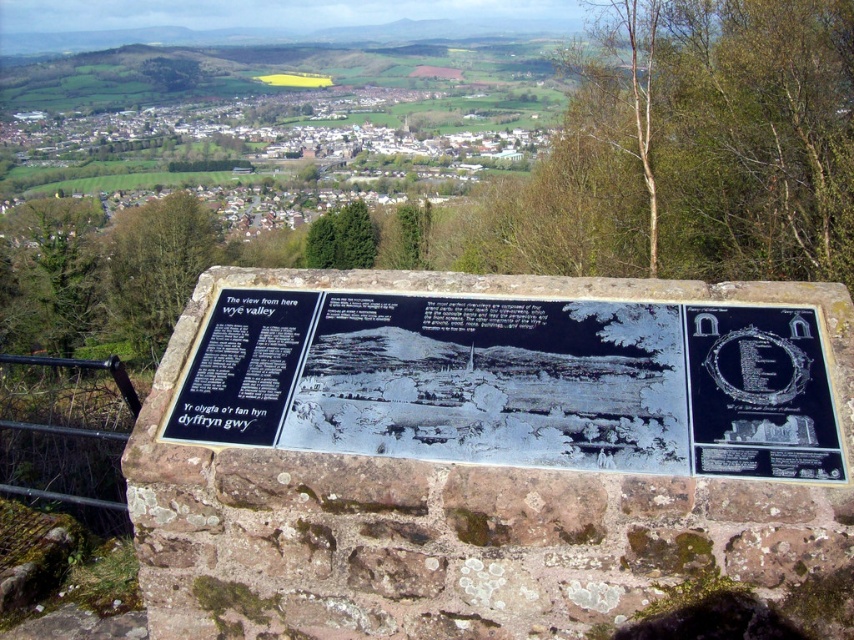
Question: Is black stone sign at center thinner than black stone plaque at upper right?

Choices:
 (A) no
 (B) yes

Answer: (A)

Question: Is black stone sign at center positioned before black stone plaque at upper right?

Choices:
 (A) no
 (B) yes

Answer: (A)

Question: Can you confirm if black stone sign at center is wider than black stone plaque at upper right?

Choices:
 (A) no
 (B) yes

Answer: (B)

Question: Which point is closer to the camera taking this photo?

Choices:
 (A) (651, 339)
 (B) (793, 387)

Answer: (B)